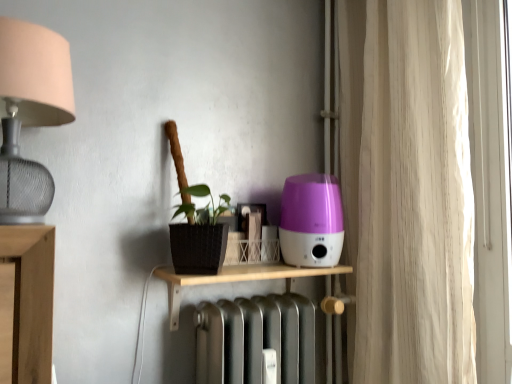
Question: Is wooden shelf at center taller or shorter than matte silver lampshade at left?

Choices:
 (A) tall
 (B) short

Answer: (B)

Question: Does point (159, 269) appear closer or farther from the camera than point (16, 122)?

Choices:
 (A) farther
 (B) closer

Answer: (A)

Question: Which of these objects is positioned closest to the wooden shelf at center?

Choices:
 (A) beige fabric curtain at right
 (B) matte silver lampshade at left
 (C) purple glossy humidifier at center-right

Answer: (C)

Question: Which object is the farthest from the beige fabric curtain at right?

Choices:
 (A) matte silver lampshade at left
 (B) purple glossy humidifier at center-right
 (C) wooden shelf at center

Answer: (A)